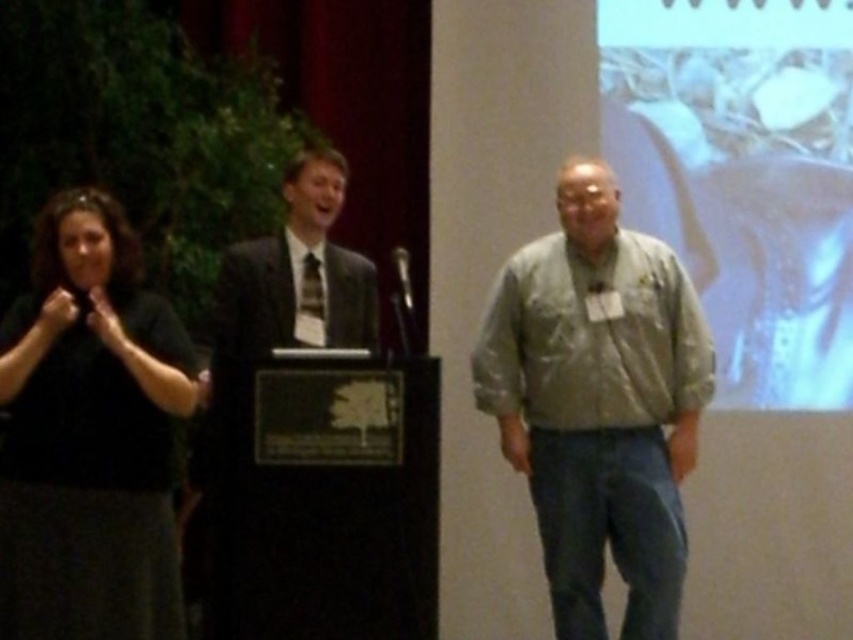
You are a photographer standing behind the camera. You want to take a photo of both the black matte shirt at left and the dark suit at center. Can you fit both subjects into the frame if your camera has a 20 inch wide field of view?

The black matte shirt at left is 19.91 inches away from the dark suit at center. Since the distance between them is less than the camera field of view of 20 inches, both subjects can be captured in the same frame.

You are attending a formal event and need to approach the speaker at the podium. There is a light gray fabric shirt at center and a dark suit at center in your way. Which one should you go around to reach the podium?

The light gray fabric shirt at center is closer to you than the dark suit at center, so you should go around the light gray fabric shirt at center first to reach the podium.